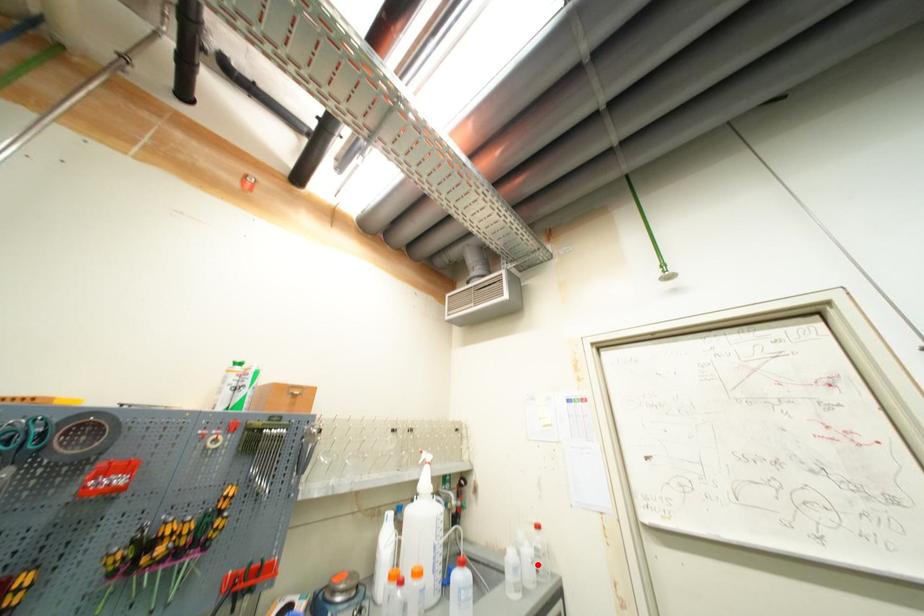
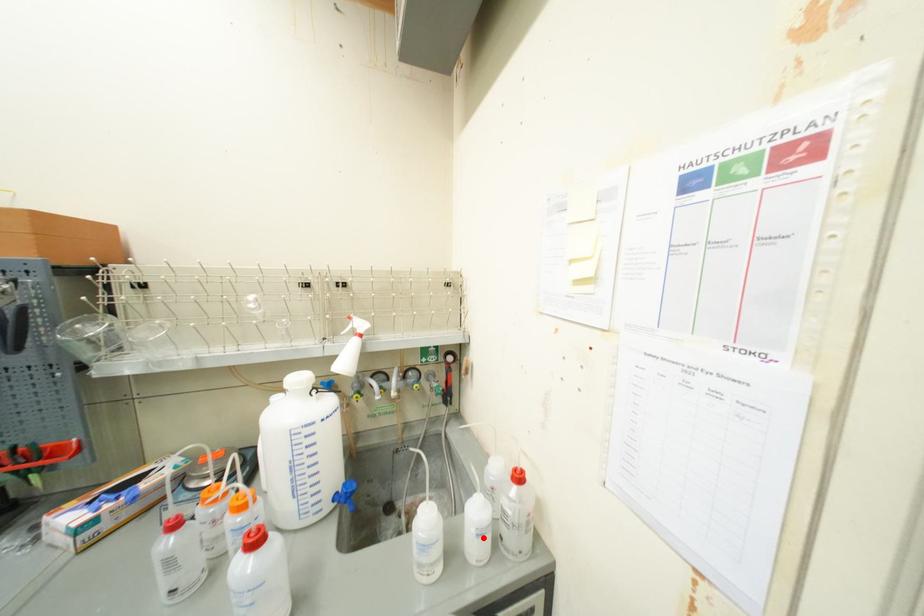
I am providing you with two images of the same scene from different viewpoints. A red point is marked on the first image and another point is marked on the second image. Does the point marked in image1 correspond to the same location as the one in image2?

Yes